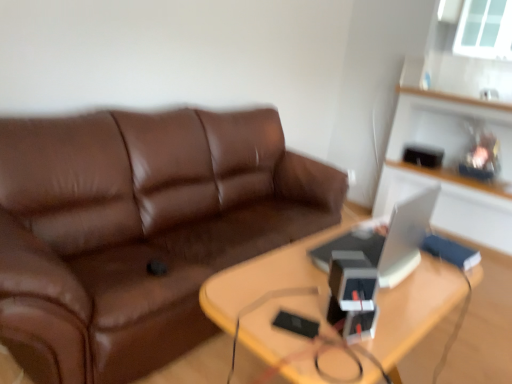
Locate an element on the screen. The height and width of the screenshot is (384, 512). free spot above wooden table at center (from a real-world perspective) is located at coordinates (328, 290).